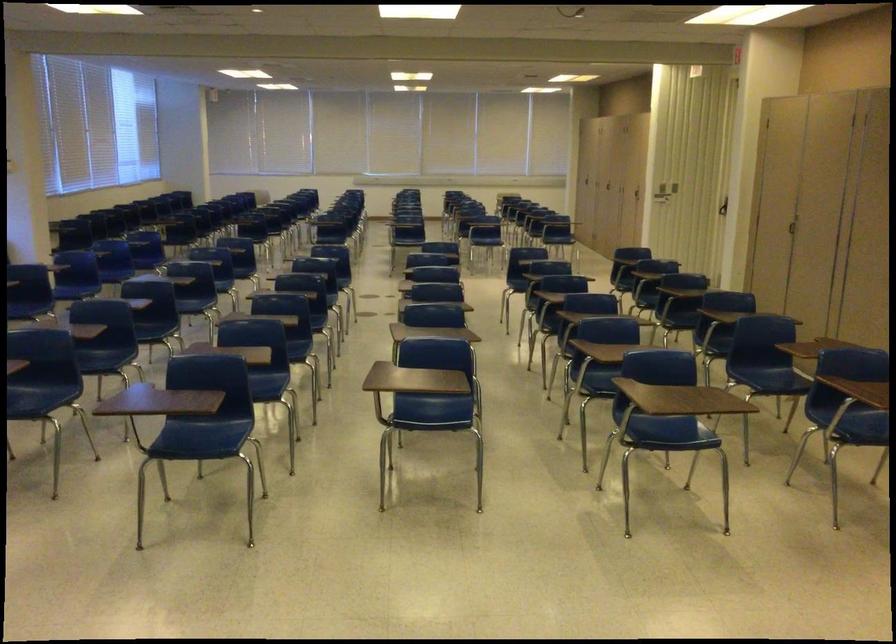
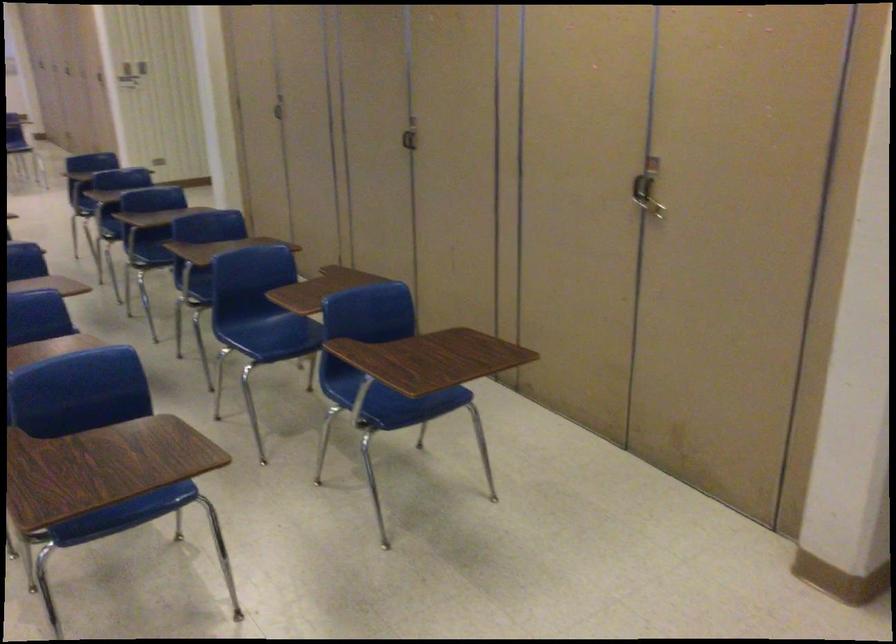
Where in the second image is the point corresponding to (x=791, y=218) from the first image?

(279, 107)